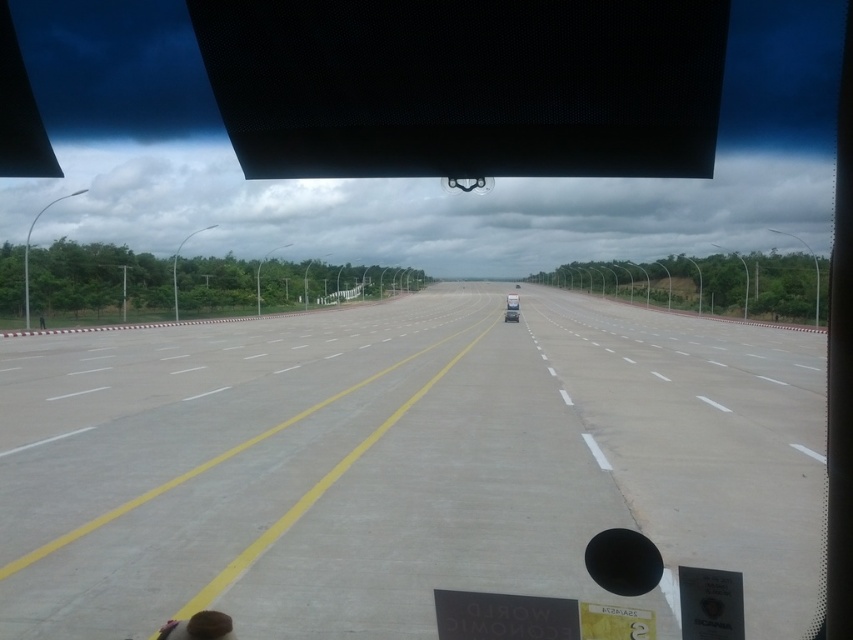
Question: Observing the image, what is the correct spatial positioning of concrete at center in reference to white glossy car at center?

Choices:
 (A) left
 (B) right

Answer: (A)

Question: Is concrete at center further to camera compared to white glossy car at center?

Choices:
 (A) no
 (B) yes

Answer: (A)

Question: Considering the relative positions of concrete at center and white glossy car at center in the image provided, where is concrete at center located with respect to white glossy car at center?

Choices:
 (A) below
 (B) above

Answer: (A)

Question: Which point is closer to the camera taking this photo?

Choices:
 (A) (517, 310)
 (B) (381, 429)

Answer: (B)